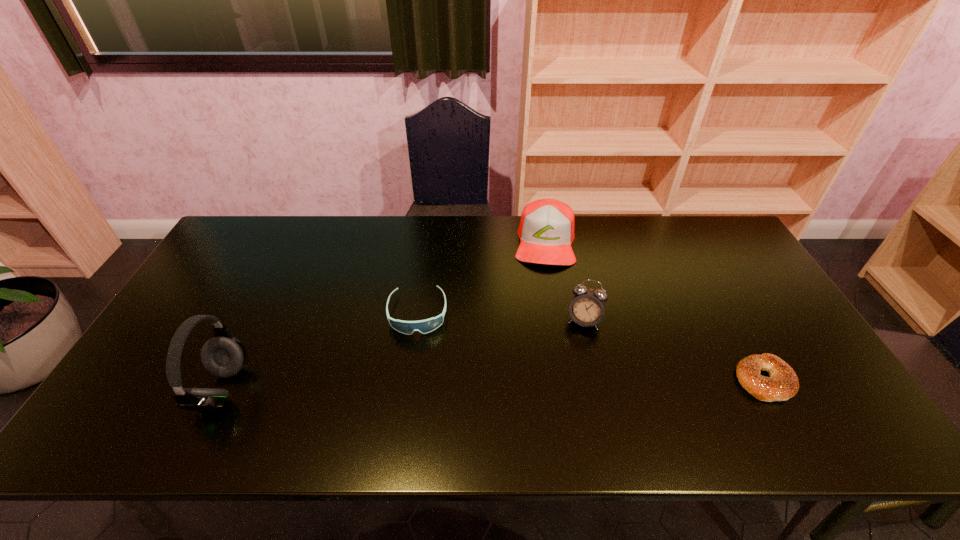
Locate an element on the screen. empty location between the farthest object and the second shortest object is located at coordinates (481, 278).

Image resolution: width=960 pixels, height=540 pixels. I want to click on blank region between the alarm clock and the goggles, so click(501, 316).

Identify the location of free point between the goggles and the farthest object. This screenshot has height=540, width=960. (481, 278).

Find the location of `free area in between the fourth object from right to left and the headset`. free area in between the fourth object from right to left and the headset is located at coordinates 320,350.

Find the location of a particular element. Image resolution: width=960 pixels, height=540 pixels. empty space between the bagel and the tallest object is located at coordinates (492, 384).

Find the location of `vacant point located between the second shortest object and the alarm clock`. vacant point located between the second shortest object and the alarm clock is located at coordinates (501, 316).

Identify the location of vacant area that lies between the rightmost object and the headset. Image resolution: width=960 pixels, height=540 pixels. (492, 384).

Locate an element on the screen. The width and height of the screenshot is (960, 540). free spot between the farthest object and the rightmost object is located at coordinates (654, 311).

Locate an element on the screen. This screenshot has width=960, height=540. free space between the baseball cap and the alarm clock is located at coordinates (564, 281).

The image size is (960, 540). Identify the location of the fourth closest object to the shortest object. (223, 356).